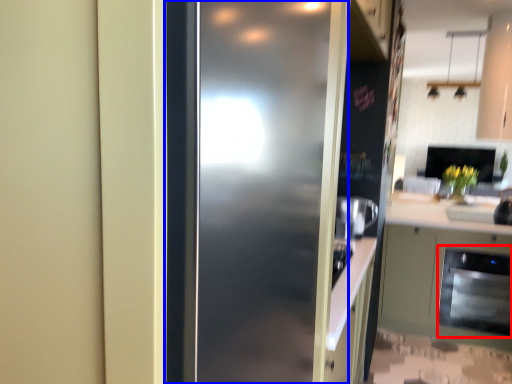
Question: Which of the following is the farthest to the observer, dish washer (highlighted by a red box) or door (highlighted by a blue box)?

Choices:
 (A) dish washer
 (B) door

Answer: (A)